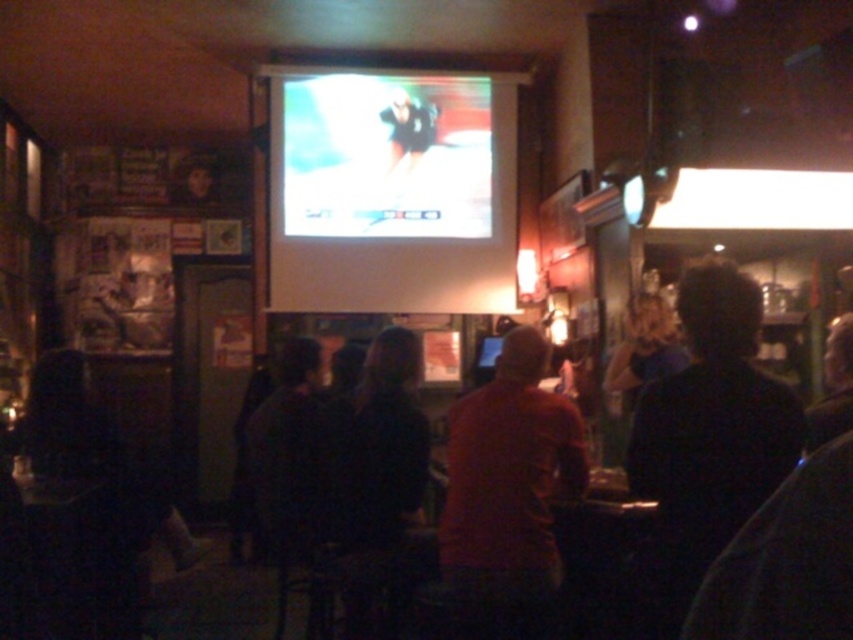
Question: Is matte plastic screen at upper center further to the viewer compared to red matte shirt at center?

Choices:
 (A) yes
 (B) no

Answer: (A)

Question: Which point appears closest to the camera in this image?

Choices:
 (A) (383, 204)
 (B) (457, 557)

Answer: (B)

Question: Considering the relative positions of matte plastic screen at upper center and red matte shirt at center in the image provided, where is matte plastic screen at upper center located with respect to red matte shirt at center?

Choices:
 (A) above
 (B) below

Answer: (A)

Question: Does matte plastic screen at upper center appear over red matte shirt at center?

Choices:
 (A) yes
 (B) no

Answer: (A)